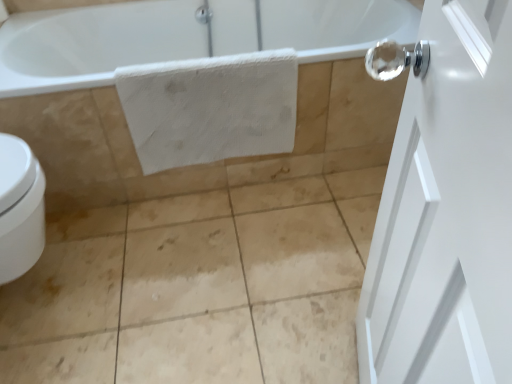
Question: Is white matte door at right bigger or smaller than white textured towel at center?

Choices:
 (A) big
 (B) small

Answer: (A)

Question: Based on their positions, is white matte door at right located to the left or right of white textured towel at center?

Choices:
 (A) left
 (B) right

Answer: (B)

Question: From a real-world perspective, is white matte door at right above or below white textured towel at center?

Choices:
 (A) below
 (B) above

Answer: (B)

Question: From a real-world perspective, is white textured towel at center positioned above or below white matte door at right?

Choices:
 (A) below
 (B) above

Answer: (A)

Question: In terms of size, does white textured towel at center appear bigger or smaller than white matte door at right?

Choices:
 (A) big
 (B) small

Answer: (B)

Question: Is white textured towel at center spatially inside white matte door at right, or outside of it?

Choices:
 (A) inside
 (B) outside

Answer: (B)

Question: From the image's perspective, relative to white matte door at right, is white textured towel at center above or below?

Choices:
 (A) above
 (B) below

Answer: (A)